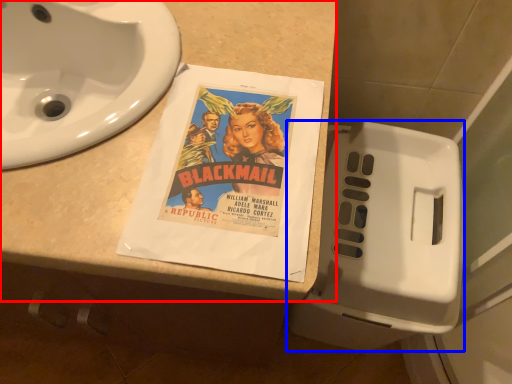
Question: Which of the following is the closest to the observer, counter top (highlighted by a red box) or toilet (highlighted by a blue box)?

Choices:
 (A) counter top
 (B) toilet

Answer: (A)